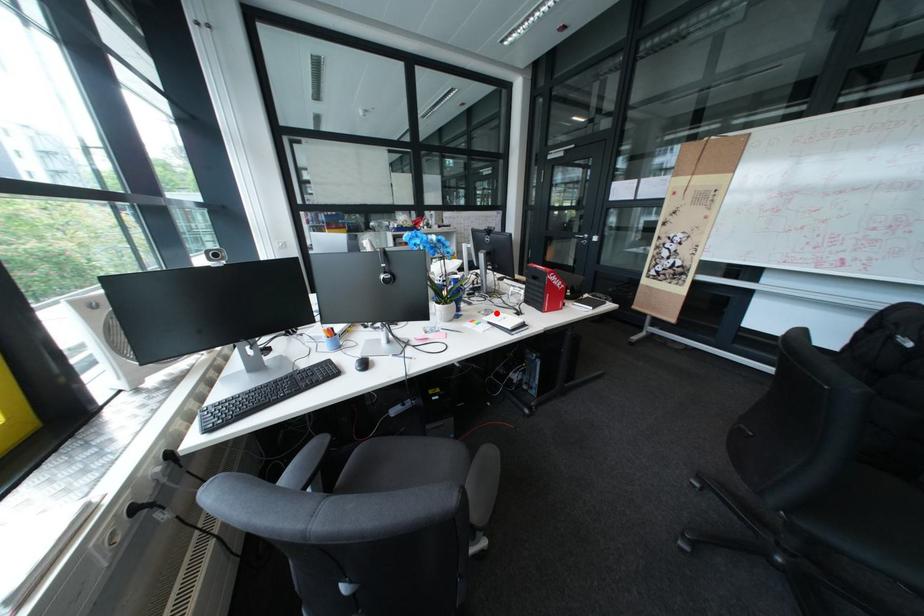
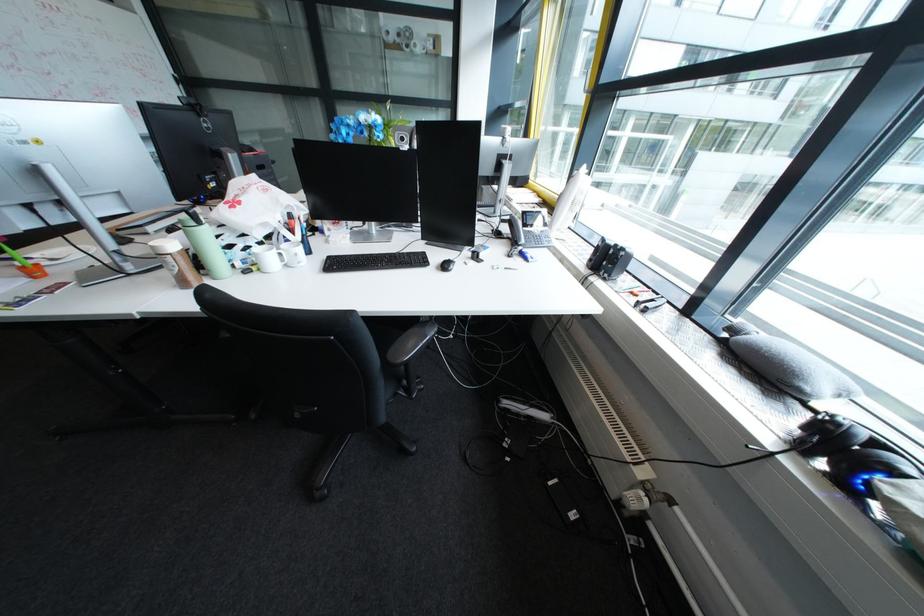
Question: I am providing you with two images of the same scene from different viewpoints. A red point is marked on the first image. Is the red point's position out of view in image 2?

Choices:
 (A) Yes
 (B) No

Answer: (A)